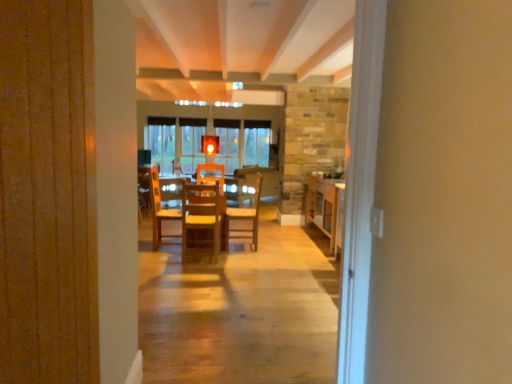
This screenshot has width=512, height=384. Identify the location of vacant area to the right of wooden chair at center, which appears as the first chair when viewed from the back. point(273,242).